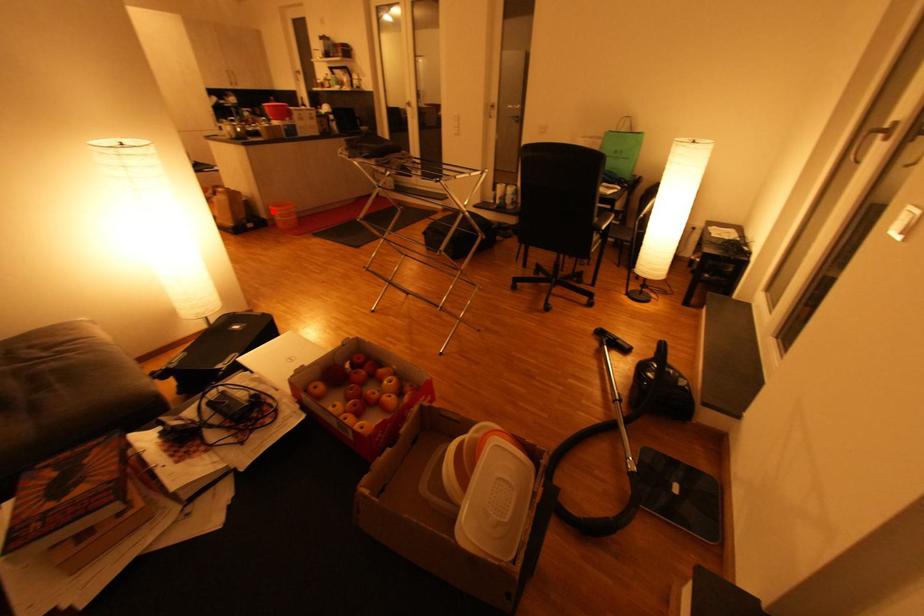
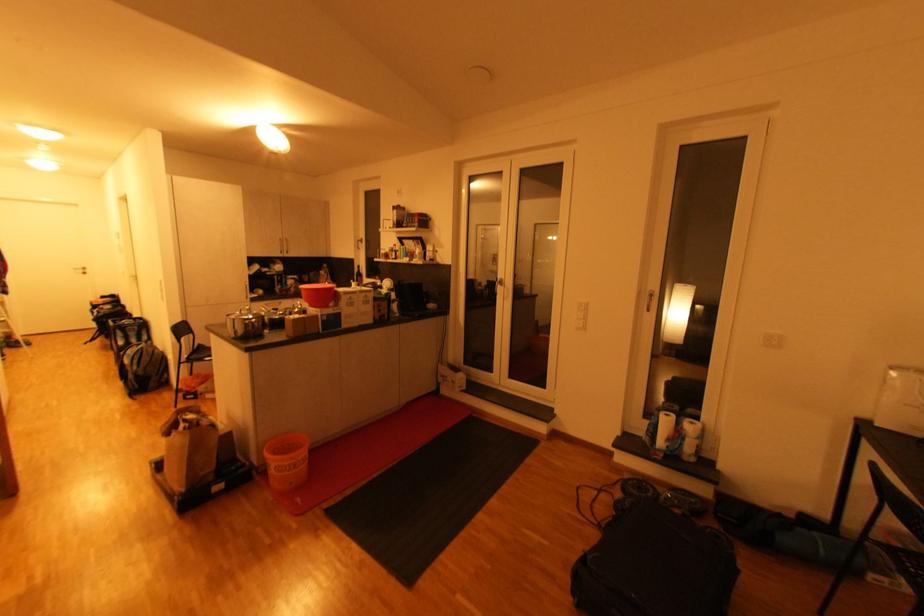
Question: I am providing you with two images of the same scene from different viewpoints. Given a red point in image1, look at the same physical point in image2. Is it:

Choices:
 (A) Closer to the viewpoint
 (B) Farther from the viewpoint

Answer: (B)